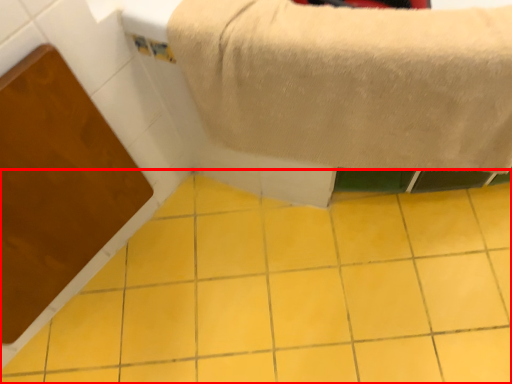
Question: From the image's perspective, where is ceramic tile (annotated by the red box) located in relation to towel in the image?

Choices:
 (A) above
 (B) below

Answer: (B)